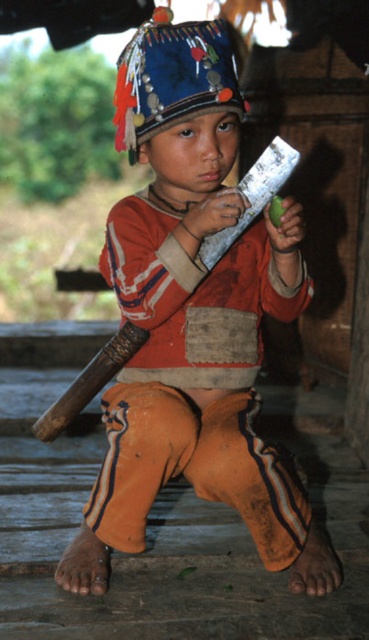
Can you confirm if brown wood baseball bat at lower left is shorter than silver metallic baseball bat at center?

No, brown wood baseball bat at lower left is not shorter than silver metallic baseball bat at center.

Is point (98, 353) positioned in front of point (288, 156)?

No, (98, 353) is behind (288, 156).

Does point (119, 328) come in front of point (292, 156)?

No.

The image size is (369, 640). Find the location of `brown wood baseball bat at lower left`. brown wood baseball bat at lower left is located at coordinates (91, 380).

Does point (138, 195) come closer to viewer compared to point (263, 179)?

No.

Does orange cotton pants at lower center have a larger size compared to silver metallic baseball bat at center?

Yes.

Is point (263, 468) in front of point (212, 259)?

Yes.

This screenshot has width=369, height=640. What are the coordinates of `orange cotton pants at lower center` in the screenshot? It's located at (192, 317).

Which is above, orange cotton pants at lower center or brown wood baseball bat at lower left?

orange cotton pants at lower center is higher up.

Does point (115, 246) come behind point (74, 394)?

That is False.

You are a GUI agent. You are given a task and a screenshot of the screen. Output one action in this format:
    pyautogui.click(x=<x>, y=<y>)
    Task: Click on the orange cotton pants at lower center
    The width and height of the screenshot is (369, 640).
    Given the screenshot: What is the action you would take?
    pyautogui.click(x=192, y=317)